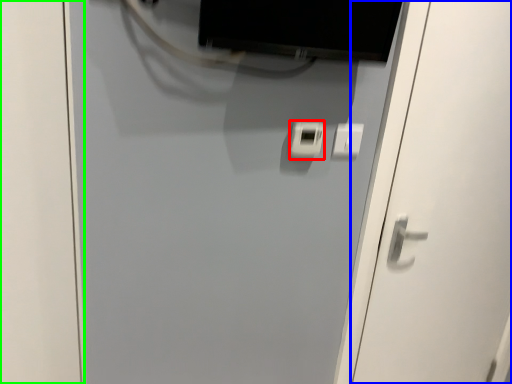
Question: Estimate the real-world distances between objects in this image. Which object is closer to light switch (highlighted by a red box), door (highlighted by a blue box) or door (highlighted by a green box)?

Choices:
 (A) door
 (B) door

Answer: (A)